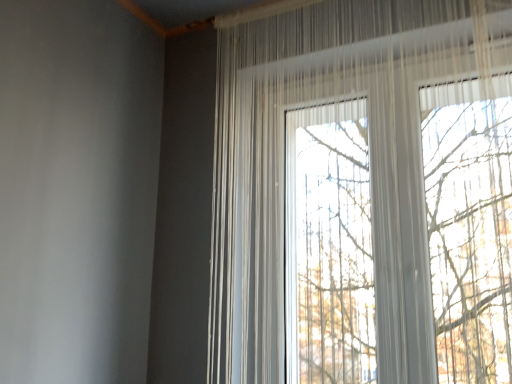
This screenshot has height=384, width=512. Describe the element at coordinates (369, 158) in the screenshot. I see `white sheer curtain at right` at that location.

You are a GUI agent. You are given a task and a screenshot of the screen. Output one action in this format:
    pyautogui.click(x=<x>, y=<y>)
    Task: Click on the white sheer curtain at right
    
    Given the screenshot: What is the action you would take?
    pyautogui.click(x=369, y=158)

Measure the distance between white sheer curtain at right and camera.

white sheer curtain at right is 3.63 feet away from camera.

Where is `white sheer curtain at right`? The image size is (512, 384). white sheer curtain at right is located at coordinates (369, 158).